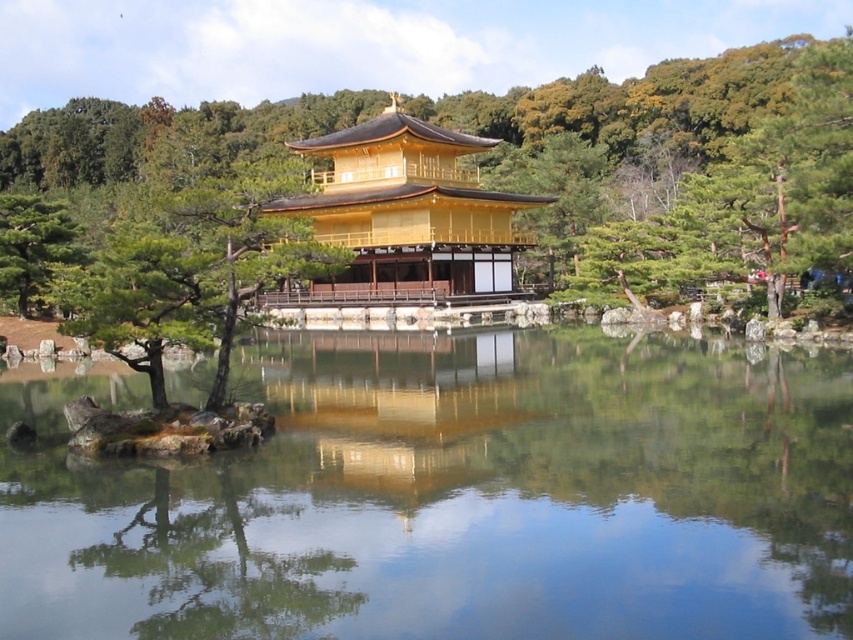
Can you confirm if transparent glass water at center is thinner than golden polished wood temple at center?

No, transparent glass water at center is not thinner than golden polished wood temple at center.

Locate an element on the screen. transparent glass water at center is located at coordinates (454, 497).

Is golden polished wood temple at center to the left of green matte tree at center-left from the viewer's perspective?

No, golden polished wood temple at center is not to the left of green matte tree at center-left.

At what (x,y) coordinates should I click in order to perform the action: click on golden polished wood temple at center. Please return your answer as a coordinate pair (x, y). Image resolution: width=853 pixels, height=640 pixels. Looking at the image, I should click on (405, 216).

Locate an element on the screen. The width and height of the screenshot is (853, 640). golden polished wood temple at center is located at coordinates (405, 216).

Between point (543, 120) and point (480, 461), which one is positioned behind?

The point (543, 120) is behind.

Can you confirm if green leafy tree at center is wider than gold reflective surface at center?

Yes, green leafy tree at center is wider than gold reflective surface at center.

The width and height of the screenshot is (853, 640). I want to click on green leafy tree at center, so click(616, 129).